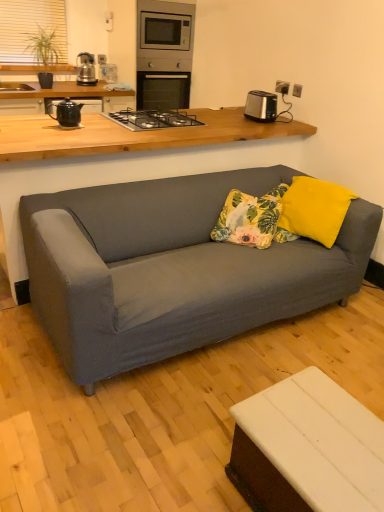
Find the location of a particular element. The width and height of the screenshot is (384, 512). vacant area located to the right-hand side of black ceramic teapot at left is located at coordinates pyautogui.click(x=103, y=126).